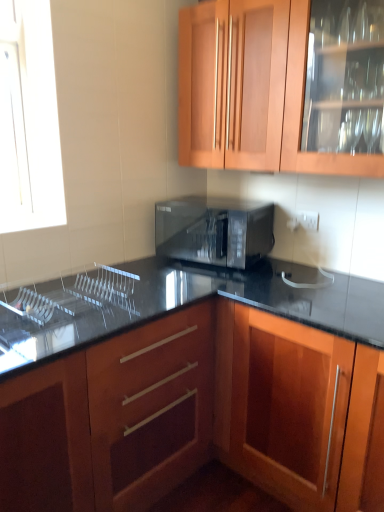
This screenshot has height=512, width=384. What do you see at coordinates (190, 400) in the screenshot?
I see `wooden cabinet at center, which ranks as the 1th cabinetry in bottom-to-top order` at bounding box center [190, 400].

Describe the element at coordinates (283, 86) in the screenshot. This screenshot has width=384, height=512. I see `wooden cabinet at upper center, the 1th cabinetry positioned from the top` at that location.

Locate an element on the screen. This screenshot has width=384, height=512. wooden cabinet at center, which ranks as the 1th cabinetry in bottom-to-top order is located at coordinates coord(190,400).

From the picture: Considering the relative sizes of black glossy microwave at center and clear glass sink at lower left in the image provided, is black glossy microwave at center smaller than clear glass sink at lower left?

Actually, black glossy microwave at center might be larger than clear glass sink at lower left.

Considering the sizes of black glossy microwave at center and clear glass sink at lower left in the image, is black glossy microwave at center wider or thinner than clear glass sink at lower left?

black glossy microwave at center is wider than clear glass sink at lower left.

Does black glossy microwave at center turn towards clear glass sink at lower left?

Yes, black glossy microwave at center is turned towards clear glass sink at lower left.

From the image's perspective, does wooden cabinet at center, which is counted as the second cabinetry, starting from the top, appear higher than clear glass sink at lower left?

No, from the image's perspective, wooden cabinet at center, which is counted as the second cabinetry, starting from the top, is not over clear glass sink at lower left.

Considering the relative positions of wooden cabinet at center, which is counted as the second cabinetry, starting from the top, and clear glass sink at lower left in the image provided, is wooden cabinet at center, which is counted as the second cabinetry, starting from the top, to the right of clear glass sink at lower left from the viewer's perspective?

Yes.

Can you confirm if black glossy microwave at center is thinner than wooden cabinet at center, which ranks as the 1th cabinetry in bottom-to-top order?

Yes, black glossy microwave at center is thinner than wooden cabinet at center, which ranks as the 1th cabinetry in bottom-to-top order.

Is black glossy microwave at center aimed at wooden cabinet at center, which is counted as the second cabinetry, starting from the top?

No, black glossy microwave at center is not oriented towards wooden cabinet at center, which is counted as the second cabinetry, starting from the top.

Considering the relative sizes of black glossy microwave at center and wooden cabinet at center, which is counted as the second cabinetry, starting from the top, in the image provided, is black glossy microwave at center bigger than wooden cabinet at center, which is counted as the second cabinetry, starting from the top,?

No.

From the black glossy microwave at center, count 1st cabinetry to the right and point to it. Please provide its 2D coordinates.

[(190, 400)]

Does wooden cabinet at center, which ranks as the 1th cabinetry in bottom-to-top order, turn towards black glossy microwave at center?

No, wooden cabinet at center, which ranks as the 1th cabinetry in bottom-to-top order, is not oriented towards black glossy microwave at center.

Is wooden cabinet at center, which is counted as the second cabinetry, starting from the top, taller than black glossy microwave at center?

Correct, wooden cabinet at center, which is counted as the second cabinetry, starting from the top, is much taller as black glossy microwave at center.

In the scene shown: Are wooden cabinet at center, which ranks as the 1th cabinetry in bottom-to-top order, and black glossy microwave at center making contact?

There is a gap between wooden cabinet at center, which ranks as the 1th cabinetry in bottom-to-top order, and black glossy microwave at center.

Which of these two, wooden cabinet at center, which ranks as the 1th cabinetry in bottom-to-top order, or black glossy microwave at center, is bigger?

wooden cabinet at center, which ranks as the 1th cabinetry in bottom-to-top order, is bigger.

Is clear glass sink at lower left facing away from wooden cabinet at center, which is counted as the second cabinetry, starting from the top?

clear glass sink at lower left is not turned away from wooden cabinet at center, which is counted as the second cabinetry, starting from the top.

Is clear glass sink at lower left to the left or to the right of wooden cabinet at center, which ranks as the 1th cabinetry in bottom-to-top order, in the image?

In the image, clear glass sink at lower left appears on the left side of wooden cabinet at center, which ranks as the 1th cabinetry in bottom-to-top order.

From the image's perspective, which one is positioned lower, wooden cabinet at upper center, the 1th cabinetry positioned from the top, or clear glass sink at lower left?

From the image's view, clear glass sink at lower left is below.

Considering their positions, is wooden cabinet at upper center, the 1th cabinetry positioned from the top, located in front of or behind clear glass sink at lower left?

Clearly, wooden cabinet at upper center, the 1th cabinetry positioned from the top, is in front of clear glass sink at lower left.

The image size is (384, 512). Find the location of `cabinetry above the clear glass sink at lower left (from a real-world perspective)`. cabinetry above the clear glass sink at lower left (from a real-world perspective) is located at coordinates (283, 86).

How distant is wooden cabinet at upper center, the 1th cabinetry positioned from the top, from clear glass sink at lower left?

3.32 feet.

From the image's perspective, would you say black glossy microwave at center is shown under wooden cabinet at upper center, the second cabinetry in the bottom-to-top sequence?

Yes.

Is black glossy microwave at center not near wooden cabinet at upper center, the 1th cabinetry positioned from the top?

Actually, black glossy microwave at center and wooden cabinet at upper center, the 1th cabinetry positioned from the top, are a little close together.

The width and height of the screenshot is (384, 512). Find the location of `the 1st cabinetry in front of the black glossy microwave at center`. the 1st cabinetry in front of the black glossy microwave at center is located at coordinates (283, 86).

Considering the sizes of objects black glossy microwave at center and wooden cabinet at upper center, the second cabinetry in the bottom-to-top sequence, in the image provided, who is taller, black glossy microwave at center or wooden cabinet at upper center, the second cabinetry in the bottom-to-top sequence,?

With more height is wooden cabinet at upper center, the second cabinetry in the bottom-to-top sequence.

Find the location of a particular element. The width and height of the screenshot is (384, 512). microwave oven behind the clear glass sink at lower left is located at coordinates (214, 231).

Where is `sink lying on the left of wooden cabinet at center, which ranks as the 1th cabinetry in bottom-to-top order`? The image size is (384, 512). sink lying on the left of wooden cabinet at center, which ranks as the 1th cabinetry in bottom-to-top order is located at coordinates (63, 313).

From the image, which object appears to be nearer to wooden cabinet at upper center, the 1th cabinetry positioned from the top, black glossy microwave at center or clear glass sink at lower left?

Based on the image, black glossy microwave at center appears to be nearer to wooden cabinet at upper center, the 1th cabinetry positioned from the top.

When comparing their distances from black glossy microwave at center, does wooden cabinet at upper center, the second cabinetry in the bottom-to-top sequence, or clear glass sink at lower left seem closer?

wooden cabinet at upper center, the second cabinetry in the bottom-to-top sequence, lies closer to black glossy microwave at center than the other object.

Looking at the image, which one is located closer to clear glass sink at lower left, wooden cabinet at upper center, the 1th cabinetry positioned from the top, or wooden cabinet at center, which ranks as the 1th cabinetry in bottom-to-top order?

wooden cabinet at center, which ranks as the 1th cabinetry in bottom-to-top order, is positioned closer to the anchor clear glass sink at lower left.

When comparing their distances from wooden cabinet at center, which ranks as the 1th cabinetry in bottom-to-top order, does wooden cabinet at upper center, the 1th cabinetry positioned from the top, or black glossy microwave at center seem further?

The object further to wooden cabinet at center, which ranks as the 1th cabinetry in bottom-to-top order, is wooden cabinet at upper center, the 1th cabinetry positioned from the top.

From the image, which object appears to be farther from clear glass sink at lower left, wooden cabinet at center, which is counted as the second cabinetry, starting from the top, or wooden cabinet at upper center, the 1th cabinetry positioned from the top?

Among the two, wooden cabinet at upper center, the 1th cabinetry positioned from the top, is located further to clear glass sink at lower left.

From the image, which object appears to be farther from wooden cabinet at center, which ranks as the 1th cabinetry in bottom-to-top order, clear glass sink at lower left or black glossy microwave at center?

The object further to wooden cabinet at center, which ranks as the 1th cabinetry in bottom-to-top order, is black glossy microwave at center.

Looking at the image, which one is located closer to clear glass sink at lower left, black glossy microwave at center or wooden cabinet at upper center, the second cabinetry in the bottom-to-top sequence?

Among the two, black glossy microwave at center is located nearer to clear glass sink at lower left.

Considering their positions, is wooden cabinet at center, which is counted as the second cabinetry, starting from the top, positioned closer to wooden cabinet at upper center, the 1th cabinetry positioned from the top, than clear glass sink at lower left?

wooden cabinet at center, which is counted as the second cabinetry, starting from the top.

The image size is (384, 512). I want to click on microwave oven between wooden cabinet at upper center, the second cabinetry in the bottom-to-top sequence, and wooden cabinet at center, which is counted as the second cabinetry, starting from the top, vertically, so click(x=214, y=231).

Where is `microwave oven between wooden cabinet at upper center, the second cabinetry in the bottom-to-top sequence, and clear glass sink at lower left in the up-down direction`? microwave oven between wooden cabinet at upper center, the second cabinetry in the bottom-to-top sequence, and clear glass sink at lower left in the up-down direction is located at coordinates (214, 231).

Identify the location of sink between wooden cabinet at upper center, the 1th cabinetry positioned from the top, and wooden cabinet at center, which is counted as the second cabinetry, starting from the top, in the vertical direction. This screenshot has height=512, width=384. (63, 313).

You are a GUI agent. You are given a task and a screenshot of the screen. Output one action in this format:
    pyautogui.click(x=<x>, y=<y>)
    Task: Click on the microwave oven between clear glass sink at lower left and wooden cabinet at center, which ranks as the 1th cabinetry in bottom-to-top order, from left to right
    
    Given the screenshot: What is the action you would take?
    click(214, 231)